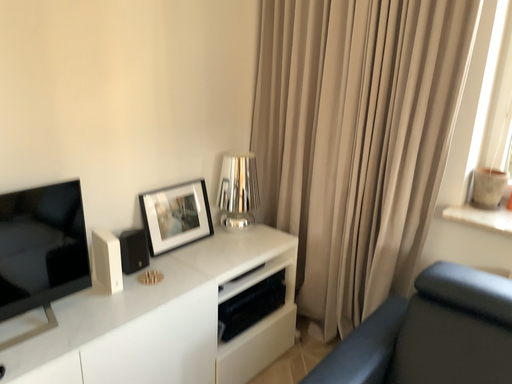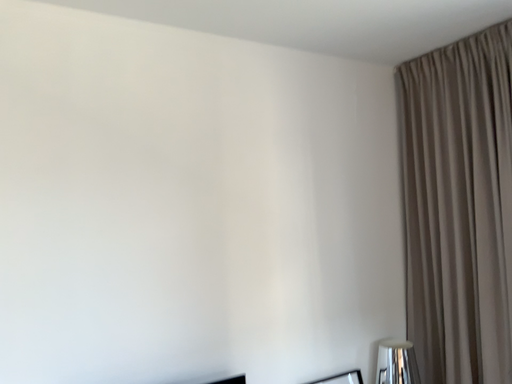
Question: How did the camera likely rotate when shooting the video?

Choices:
 (A) rotated downward
 (B) rotated upward

Answer: (B)